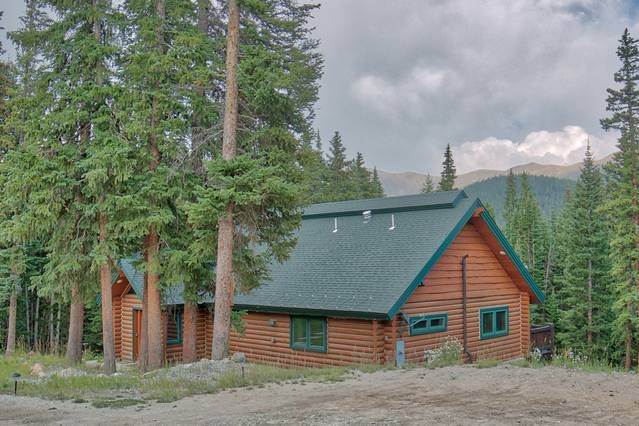
Locate an element on the screen. This screenshot has width=639, height=426. windows is located at coordinates pyautogui.click(x=433, y=327), pyautogui.click(x=488, y=326), pyautogui.click(x=304, y=327), pyautogui.click(x=174, y=328).